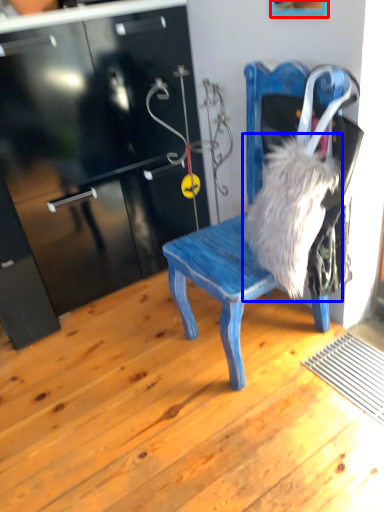
Question: Which point is further to the camera, picture frame (highlighted by a red box) or animal (highlighted by a blue box)?

Choices:
 (A) picture frame
 (B) animal

Answer: (B)